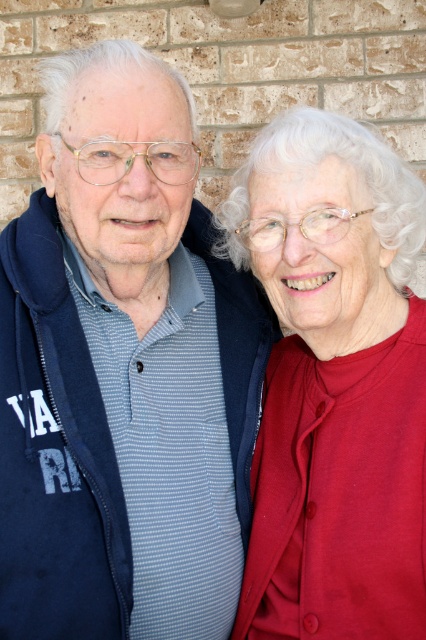
You are taking a photo of two people standing against a brick wall. You notice a blue striped shirt at center. Based on the coordinates provided in the Objects Description, is the blue striped shirt closer to the top or the bottom of the image?

The blue striped shirt at center is located at point 0.580 in the x coordinate and 0.291 in the y coordinate. Since the y coordinate is closer to 0, which typically represents the bottom of the image, the blue striped shirt at center is closer to the bottom of the image.

You are a photographer trying to capture a group photo of the blue striped shirt at center and the matte red sweater at right. The camera you are using has a minimum focus distance of 25 centimeters. Can you take a photo of both subjects clearly without moving them?

The blue striped shirt at center and the matte red sweater at right are 27.07 centimeters apart, which is within the camera minimum focus distance of 25 centimeters. Therefore, you can take a photo of both subjects clearly without moving them.

You are a photographer setting up a backdrop for a photo shoot. You need to ensure that the blue striped shirt at center and the matte red sweater at right will fit within a 1.5 meter wide backdrop. Based on their widths, will both items fit side by side?

The blue striped shirt at center might be wider than matte red sweater at right. Since their combined widths could exceed 1.5 meters, it is uncertain if they will fit side by side without overlapping or adjustment.